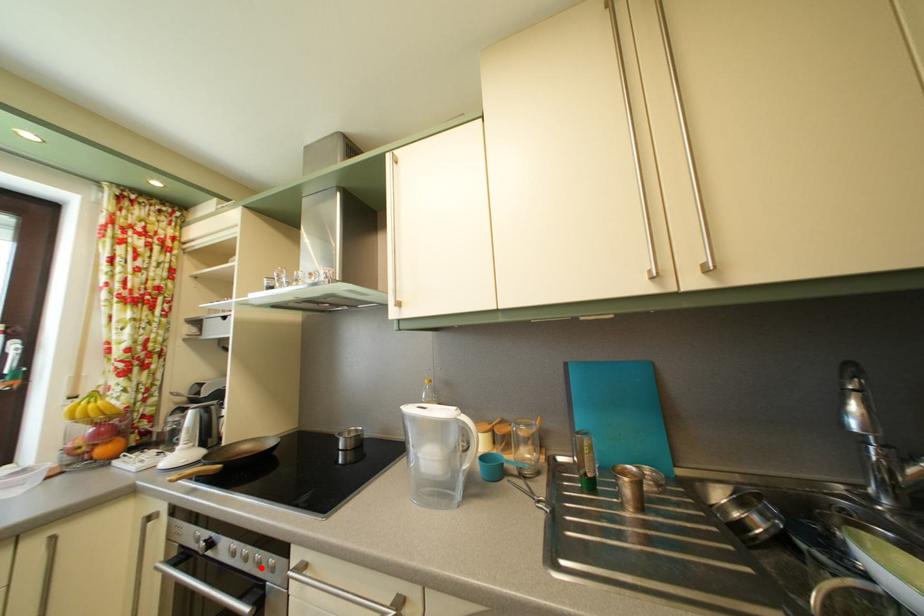
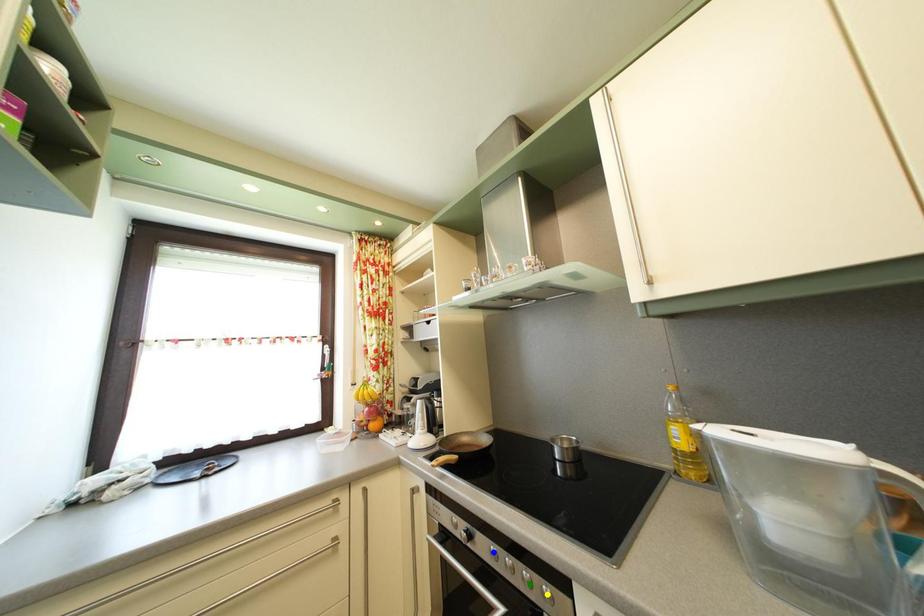
Question: I am providing you with two images of the same scene from different viewpoints. A red point is marked on the first image. You are given multiple points on the second image. Which point in image 2 represents the same 3d spot as the red point in image 1?

Choices:
 (A) green point
 (B) blue point
 (C) yellow point

Answer: (A)